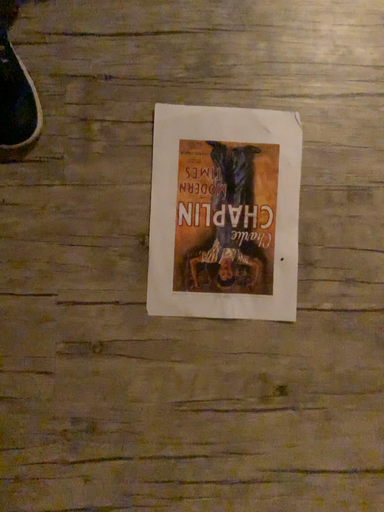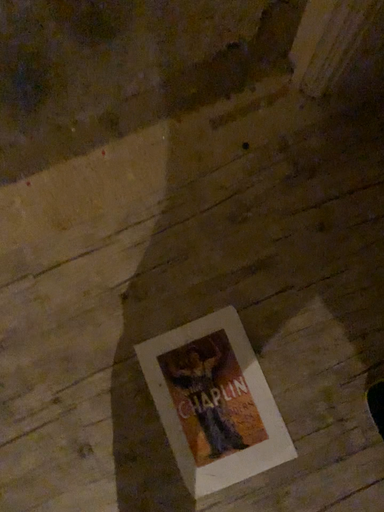
Question: How did the camera likely rotate when shooting the video?

Choices:
 (A) rotated downward
 (B) rotated upward

Answer: (B)